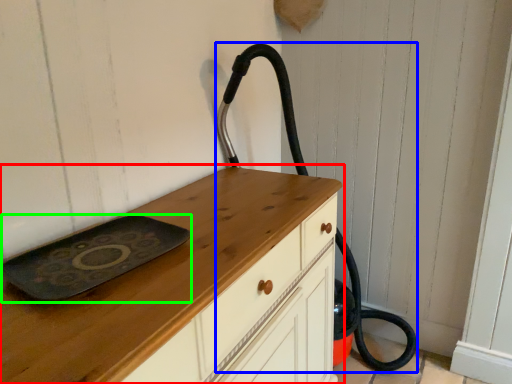
Question: Which object is positioned closest to chest of drawers (highlighted by a red box)? Select from fire hose (highlighted by a blue box) and tray (highlighted by a green box).

Choices:
 (A) fire hose
 (B) tray

Answer: (B)